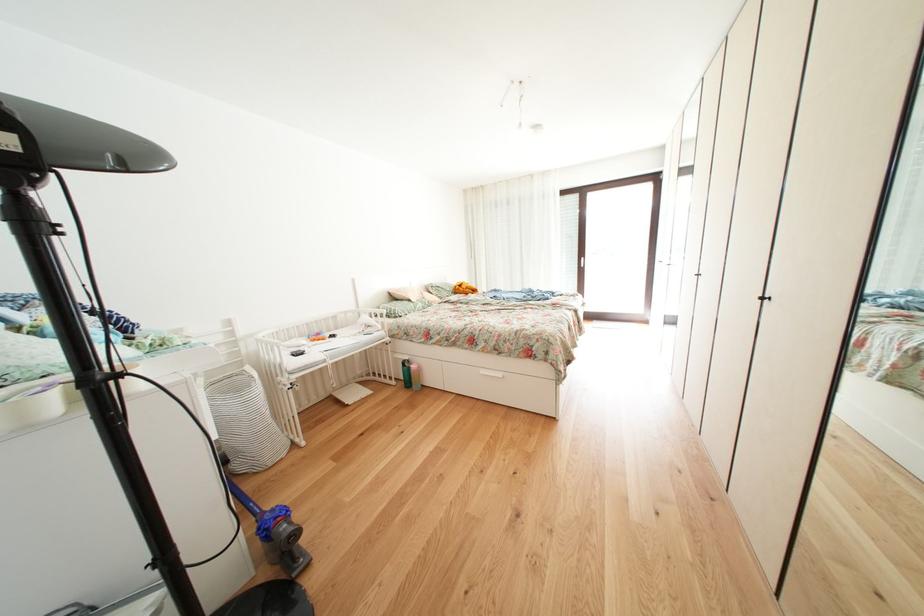
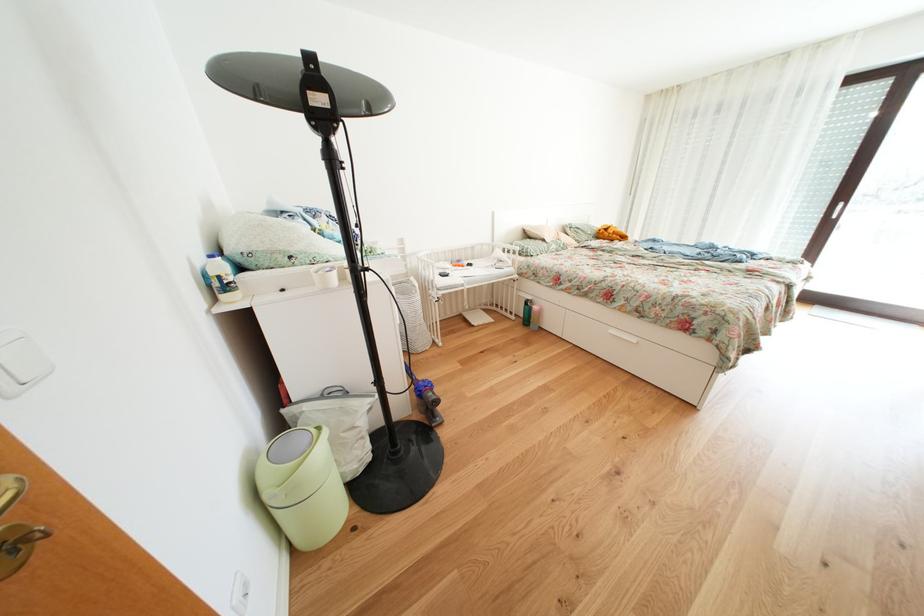
The point at (310,341) is marked in the first image. Where is the corresponding point in the second image?

(456, 265)